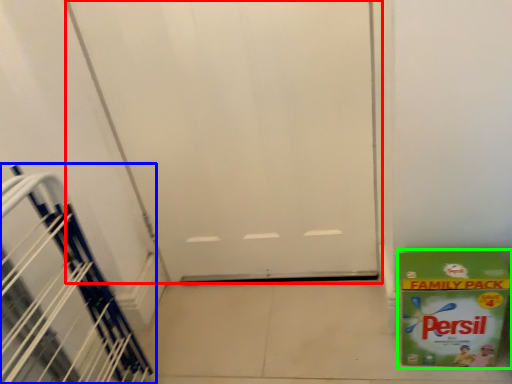
Question: Estimate the real-world distances between objects in this image. Which object is farther from door (highlighted by a red box), stairwell (highlighted by a blue box) or box (highlighted by a green box)?

Choices:
 (A) stairwell
 (B) box

Answer: (A)